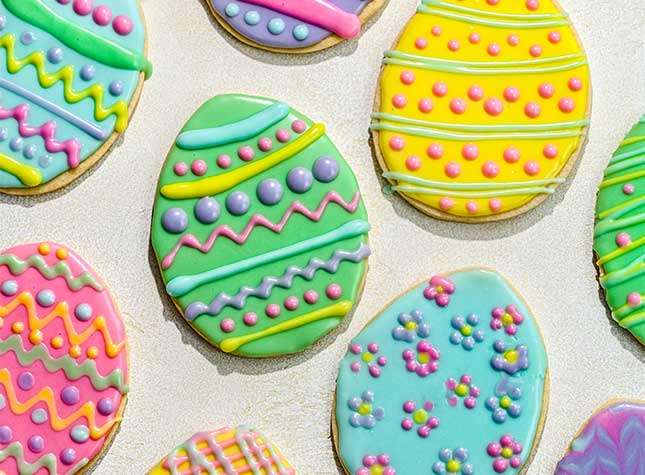
In order to click on table in this screenshot , I will do `click(588, 376)`, `click(170, 380)`.